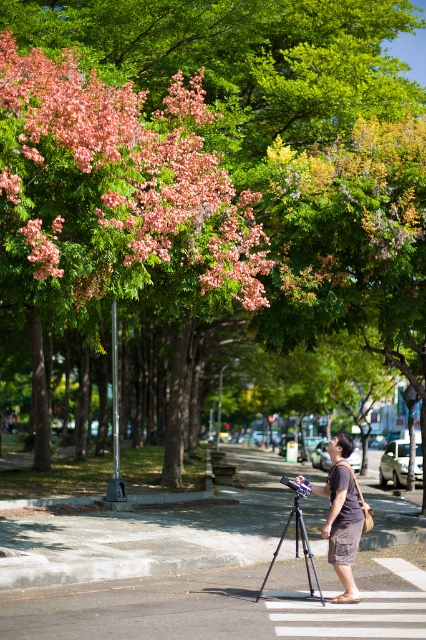
You are a photographer standing in the urban scene. You notice the brown cotton shorts at lower center and the black metallic tripod at center. Which object is taller? Please explain based on their positions and sizes.

The brown cotton shorts at lower center is much taller than the black metallic tripod at center.

You are a photographer trying to set up your equipment. You have the brown cotton shorts at lower center and the black metallic tripod at center in your view. Which object is positioned higher from the ground?

The brown cotton shorts at lower center is above the black metallic tripod at center, so it is positioned higher from the ground.